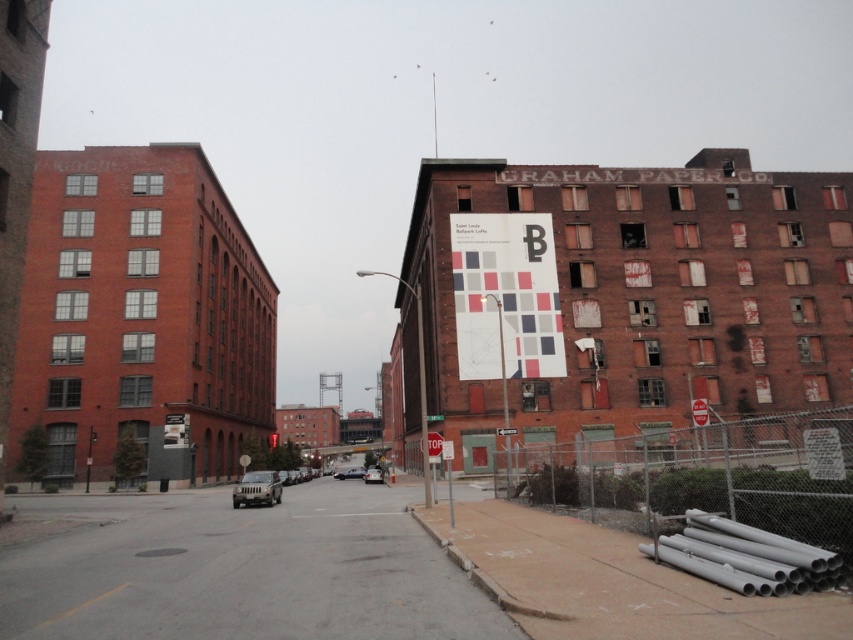
You are a pedestrian standing on the sidewalk and see the matte silver suv at center and the red paper sign at center. Which object is closer to you?

The matte silver suv at center is closer to you because it is further to the viewer than the red paper sign at center, meaning it appears nearer in the image.